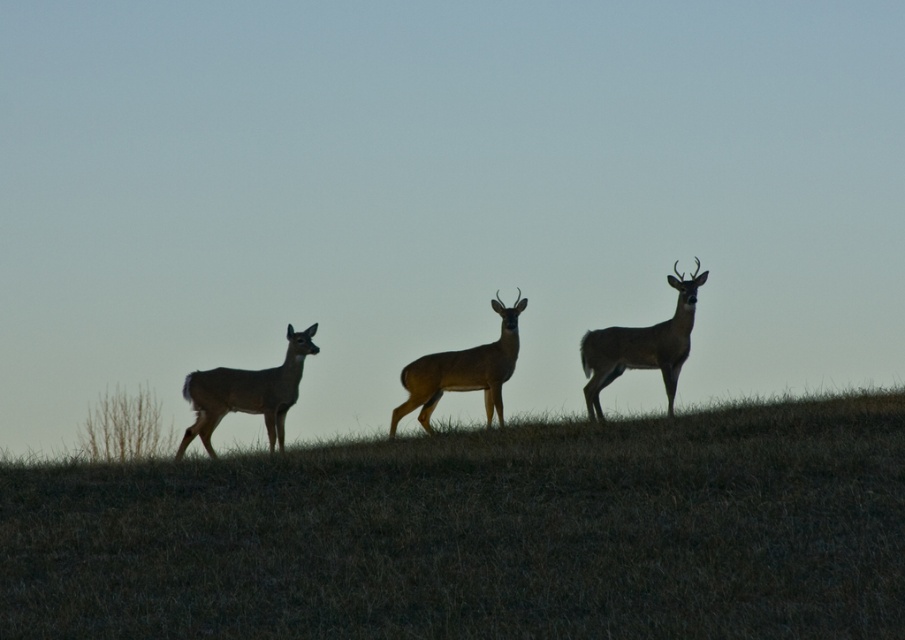
You are a wildlife photographer trying to capture the silhouette velvet deer at left and the brown fur deer at center in a single frame. Based on their sizes, which deer will appear larger in your photo?

The brown fur deer at center will appear larger in the photo because it is larger in size compared to the silhouette velvet deer at left.

You are a photographer aiming to capture the silhouette velvet deer at left and the brown grassy at center in your shot. Which object appears taller in the image?

The silhouette velvet deer at left appears taller than the brown grassy at center in the image.